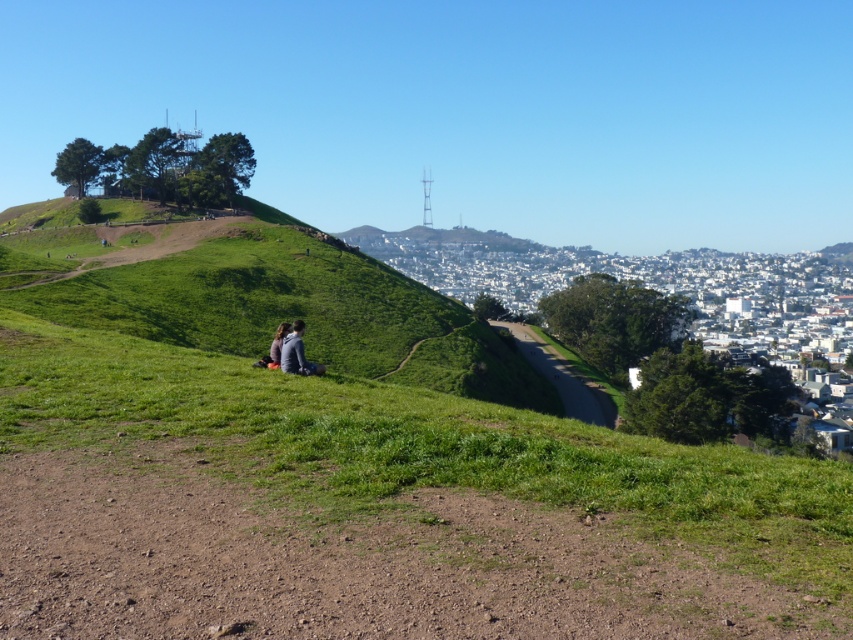
You are standing at the bottom of the green grassy hillside at center and want to reach the dark gray jacket at center. Which direction should you move to get closer to the jacket?

The green grassy hillside at center is above the dark gray jacket at center, so you should move downward towards the jacket.